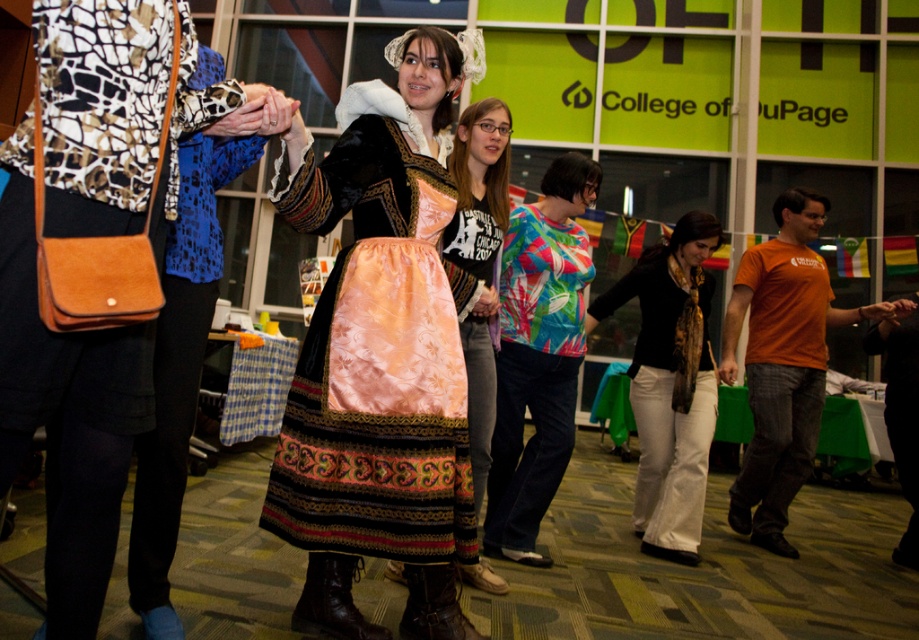
Can you confirm if matte black purse at left is positioned below satin dress at center?

Incorrect, matte black purse at left is not positioned below satin dress at center.

Does matte black purse at left come behind satin dress at center?

No, matte black purse at left is closer to the viewer.

This screenshot has width=919, height=640. In order to click on matte black purse at left in this screenshot , I will do `click(65, 408)`.

The image size is (919, 640). What are the coordinates of `matte black purse at left` in the screenshot? It's located at (65, 408).

Does point (403, 392) come farther from viewer compared to point (432, 572)?

No, it is in front of (432, 572).

Is satin dress at center above leather boot at lower center?

Yes, satin dress at center is above leather boot at lower center.

Does point (335, 538) lie behind point (430, 577)?

No.

Where is `satin dress at center`? The image size is (919, 640). satin dress at center is located at coordinates (376, 364).

Who is shorter, silk satin dress at center or brown leather boot at lower center?

With less height is brown leather boot at lower center.

Does point (495, 326) lie in front of point (295, 616)?

That is False.

Locate an element on the screen. silk satin dress at center is located at coordinates (479, 396).